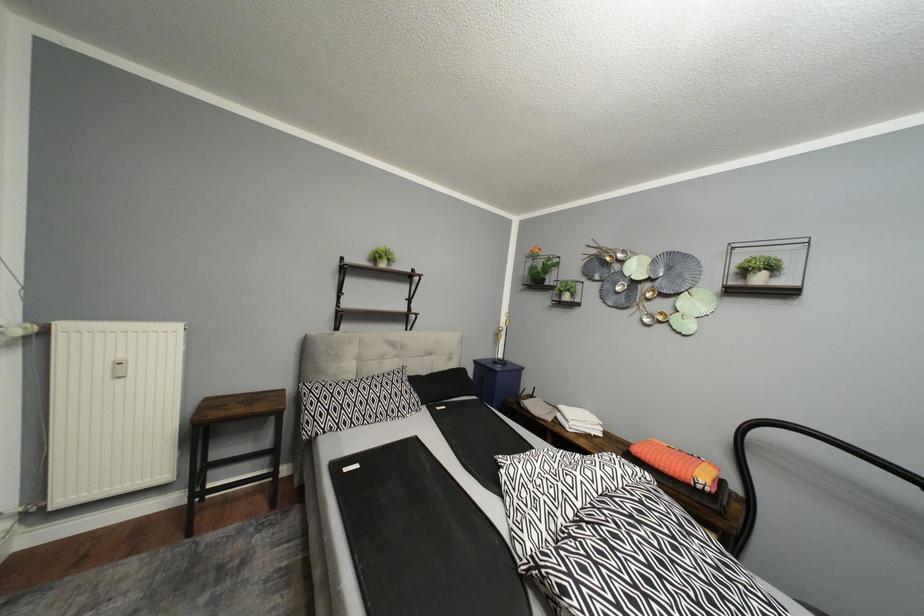
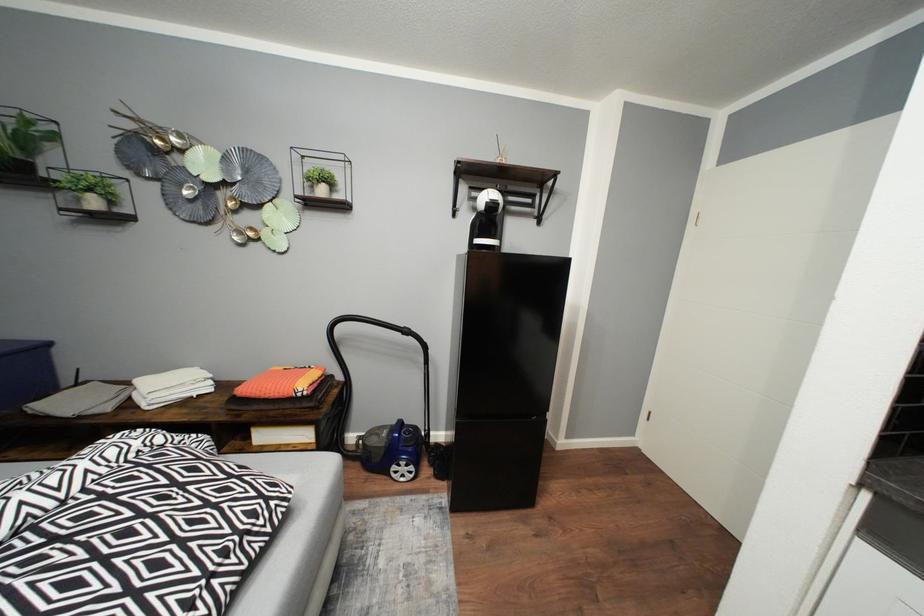
The images are taken continuously from a first-person perspective. In which direction is your viewpoint rotating?

The rotation direction of the camera is right-down.